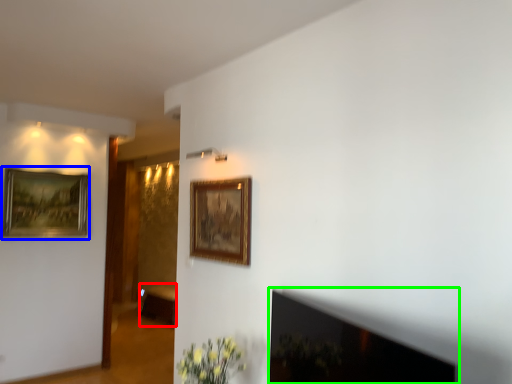
Question: Which object is positioned farthest from furniture (highlighted by a red box)? Select from picture frame (highlighted by a blue box) and fireplace (highlighted by a green box).

Choices:
 (A) picture frame
 (B) fireplace

Answer: (B)